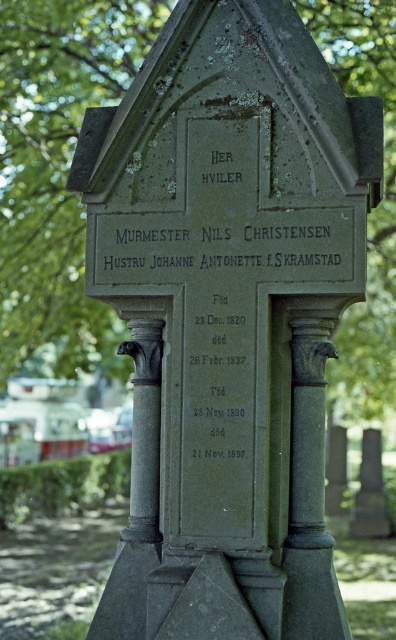
Question: Which point is closer to the camera?

Choices:
 (A) (11, 96)
 (B) (249, 332)

Answer: (B)

Question: Is green lichen-covered stone at upper center in front of black stone text at center?

Choices:
 (A) no
 (B) yes

Answer: (A)

Question: Where is green lichen-covered stone at upper center located in relation to black stone text at center in the image?

Choices:
 (A) above
 (B) below

Answer: (A)

Question: Which object appears farthest from the camera in this image?

Choices:
 (A) black stone text at center
 (B) green lichen-covered stone at upper center

Answer: (B)

Question: Is green lichen-covered stone at upper center to the right of black stone text at center from the viewer's perspective?

Choices:
 (A) no
 (B) yes

Answer: (A)

Question: Among these points, which one is nearest to the camera?

Choices:
 (A) (236, 353)
 (B) (100, 49)

Answer: (A)